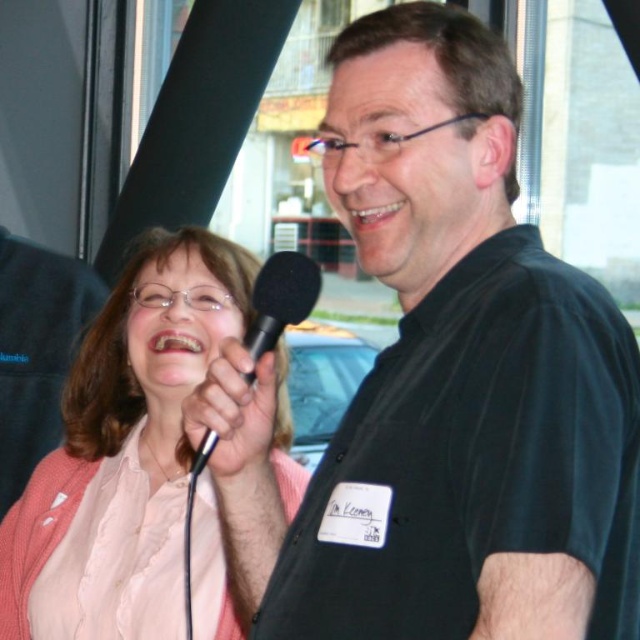
Is point (346, 212) positioned behind point (74, 492)?

No.

Does black matte shirt at center have a lesser width compared to pink fabric at upper left?

Correct, black matte shirt at center's width is less than pink fabric at upper left's.

Image resolution: width=640 pixels, height=640 pixels. What do you see at coordinates (461, 374) in the screenshot? I see `black matte shirt at center` at bounding box center [461, 374].

You are a GUI agent. You are given a task and a screenshot of the screen. Output one action in this format:
    pyautogui.click(x=<x>, y=<y>)
    Task: Click on the black matte shirt at center
    This screenshot has width=640, height=640.
    Given the screenshot: What is the action you would take?
    pyautogui.click(x=461, y=374)

Between pink fabric at upper left and black matte microphone at center, which one has more height?

pink fabric at upper left is taller.

Does pink fabric at upper left appear over black matte microphone at center?

Actually, pink fabric at upper left is below black matte microphone at center.

Locate an element on the screen. pink fabric at upper left is located at coordinates (124, 452).

From the picture: Can you confirm if black matte shirt at center is shorter than black matte microphone at center?

No.

Measure the distance between black matte shirt at center and black matte microphone at center.

They are 13.52 inches apart.

Is point (486, 179) farther from camera compared to point (296, 305)?

No.

I want to click on black matte shirt at center, so click(x=461, y=374).